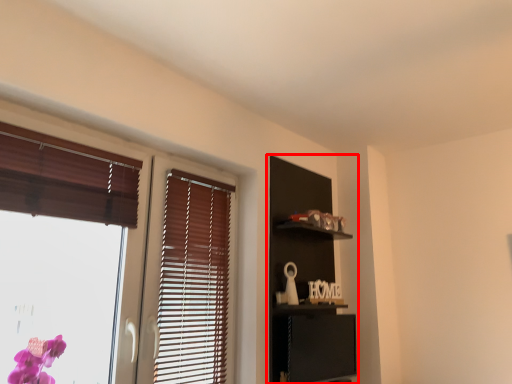
Question: Where is dresser (annotated by the red box) located in relation to window in the image?

Choices:
 (A) right
 (B) left

Answer: (A)